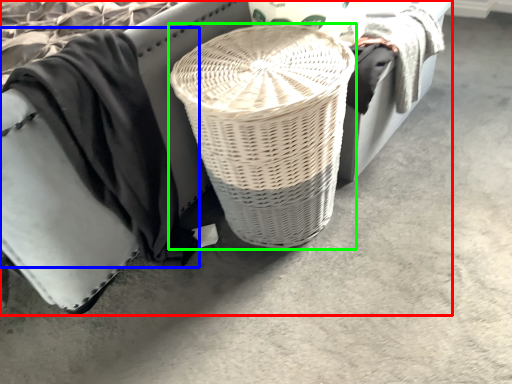
Question: Which is nearer to the furniture (highlighted by a red box)? clothing (highlighted by a blue box) or basket (highlighted by a green box).

Choices:
 (A) clothing
 (B) basket

Answer: (A)